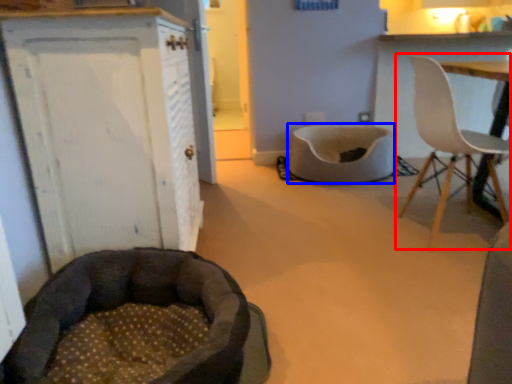
Question: Among these objects, which one is farthest to the camera, chair (highlighted by a red box) or cat bed (highlighted by a blue box)?

Choices:
 (A) chair
 (B) cat bed

Answer: (B)